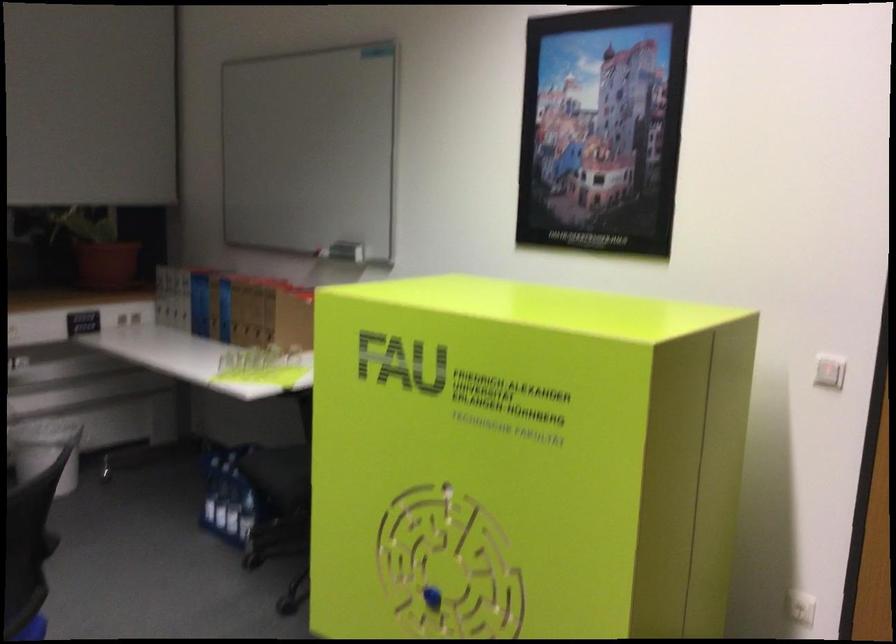
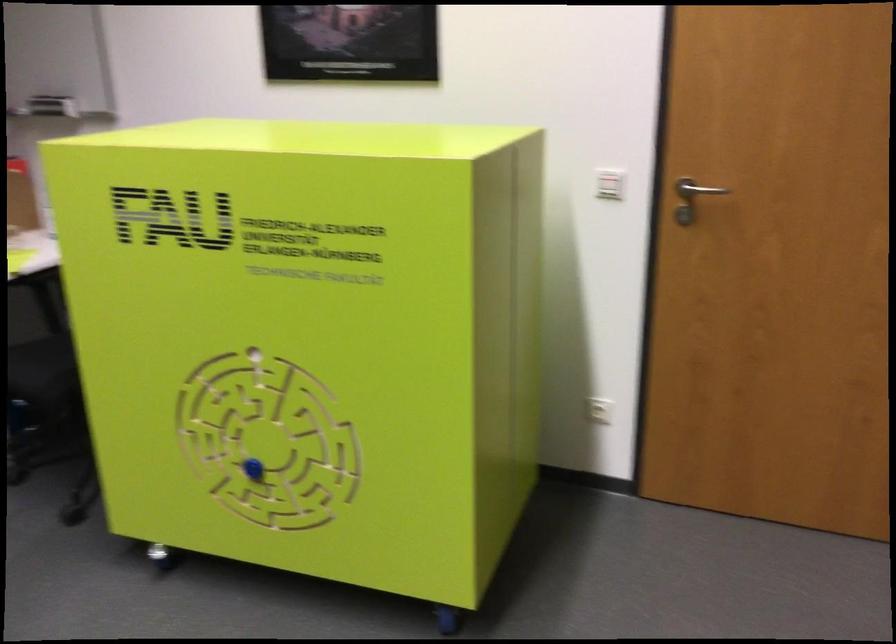
Where in the second image is the point corresponding to pixel 495 488 from the first image?

(309, 341)